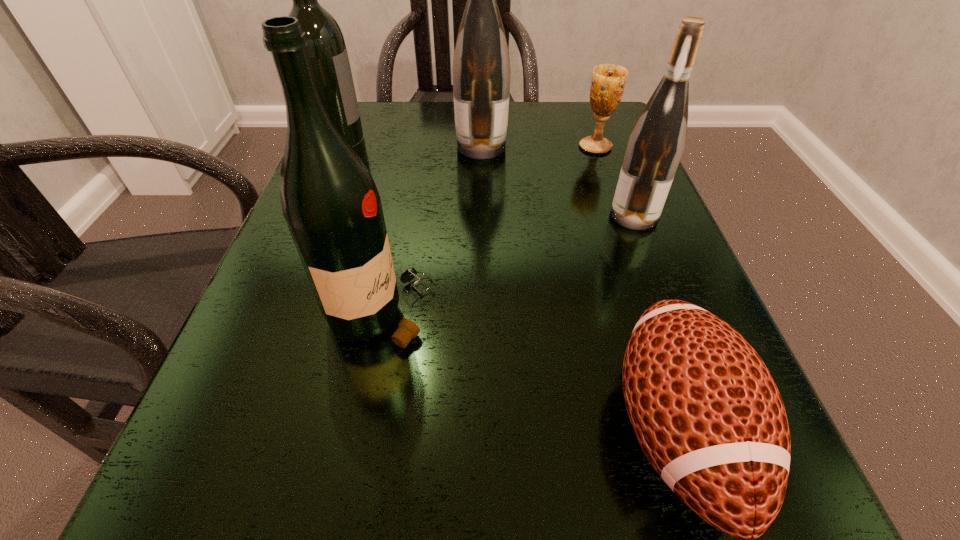
Locate an element on the screen. the third wine bottle from left to right is located at coordinates coord(481,72).

Image resolution: width=960 pixels, height=540 pixels. Find the location of `the fifth object from right to left`. the fifth object from right to left is located at coordinates (330, 202).

The image size is (960, 540). Find the location of `the third wine bottle from right to left`. the third wine bottle from right to left is located at coordinates (330, 202).

Find the location of a particular element. The height and width of the screenshot is (540, 960). the leftmost wine bottle is located at coordinates (327, 53).

I want to click on the rightmost wine bottle, so click(x=656, y=143).

Locate an element on the screen. The image size is (960, 540). the third shortest object is located at coordinates (656, 143).

Find the location of a particular element. Image resolution: width=960 pixels, height=540 pixels. chalice is located at coordinates (608, 82).

This screenshot has height=540, width=960. I want to click on free spot located on the label of the second wine bottle from right to left, so click(x=427, y=147).

Where is `blank space located 0.140m on the label of the second wine bottle from right to left`? This screenshot has width=960, height=540. blank space located 0.140m on the label of the second wine bottle from right to left is located at coordinates (390, 147).

Where is `vacant space located 0.130m on the label of the second wine bottle from right to left`? vacant space located 0.130m on the label of the second wine bottle from right to left is located at coordinates pyautogui.click(x=395, y=147).